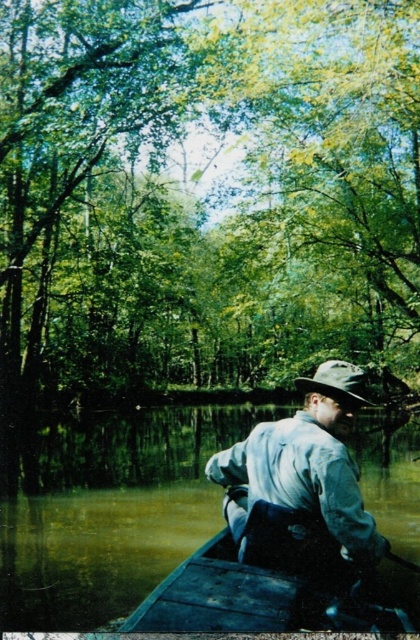
This screenshot has width=420, height=640. What do you see at coordinates (107, 509) in the screenshot? I see `greenish-brown wood at lower right` at bounding box center [107, 509].

Between greenish-brown wood at lower right and light blue denim shirt at center, which one appears on the left side from the viewer's perspective?

Positioned to the left is greenish-brown wood at lower right.

Locate an element on the screen. This screenshot has width=420, height=640. greenish-brown wood at lower right is located at coordinates (107, 509).

Where is `greenish-brown wood at lower right`? The image size is (420, 640). greenish-brown wood at lower right is located at coordinates (107, 509).

Based on the photo, does greenish-brown wood at lower right have a lesser width compared to dark brown wooden canoe at lower center?

In fact, greenish-brown wood at lower right might be wider than dark brown wooden canoe at lower center.

Does point (236, 422) come in front of point (277, 544)?

No, (236, 422) is behind (277, 544).

Locate an element on the screen. The image size is (420, 640). greenish-brown wood at lower right is located at coordinates (107, 509).

How much distance is there between green leafy trees at upper center and dark brown wooden canoe at lower center?

green leafy trees at upper center and dark brown wooden canoe at lower center are 100.47 feet apart.

Describe the element at coordinates (207, 193) in the screenshot. I see `green leafy trees at upper center` at that location.

The height and width of the screenshot is (640, 420). Describe the element at coordinates (207, 193) in the screenshot. I see `green leafy trees at upper center` at that location.

Where is `green leafy trees at upper center`? This screenshot has width=420, height=640. green leafy trees at upper center is located at coordinates (207, 193).